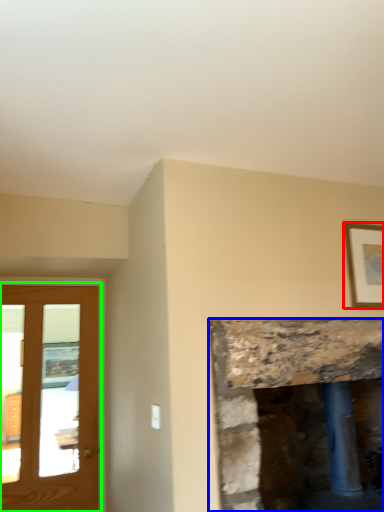
Question: Which object is positioned farthest from picture frame (highlighted by a red box)? Select from fireplace (highlighted by a blue box) and screen door (highlighted by a green box).

Choices:
 (A) fireplace
 (B) screen door

Answer: (B)